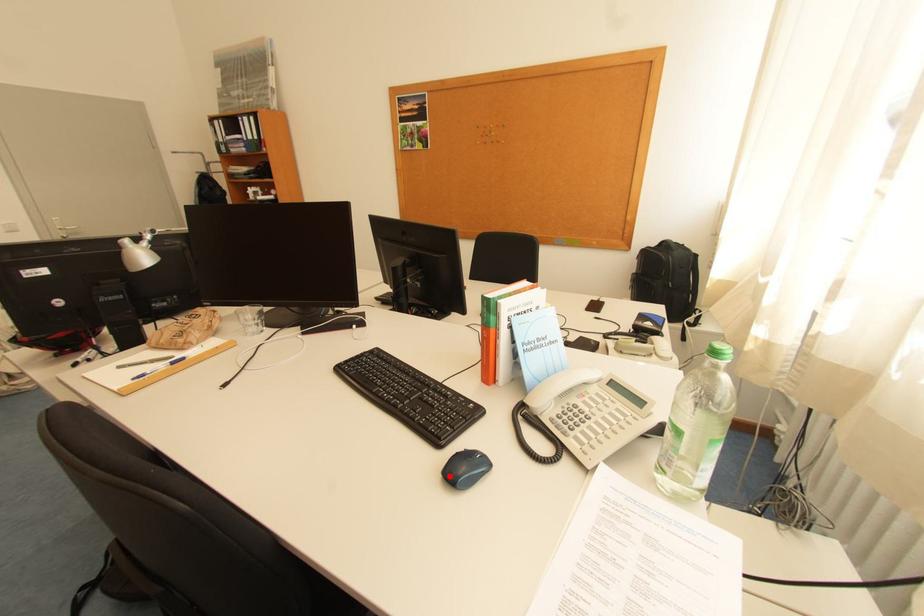
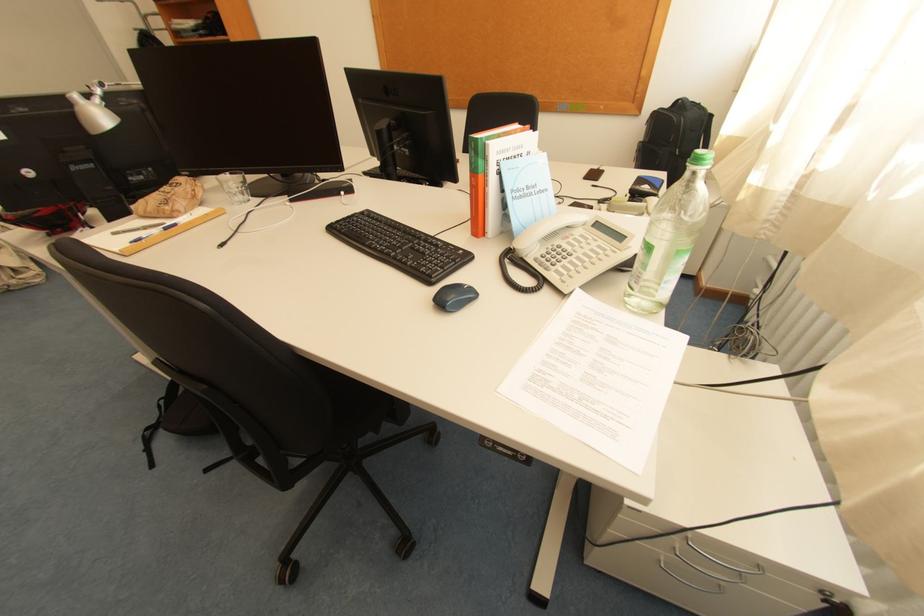
Find the pixel in the second image that matches the highlighted location in the first image.

(441, 304)